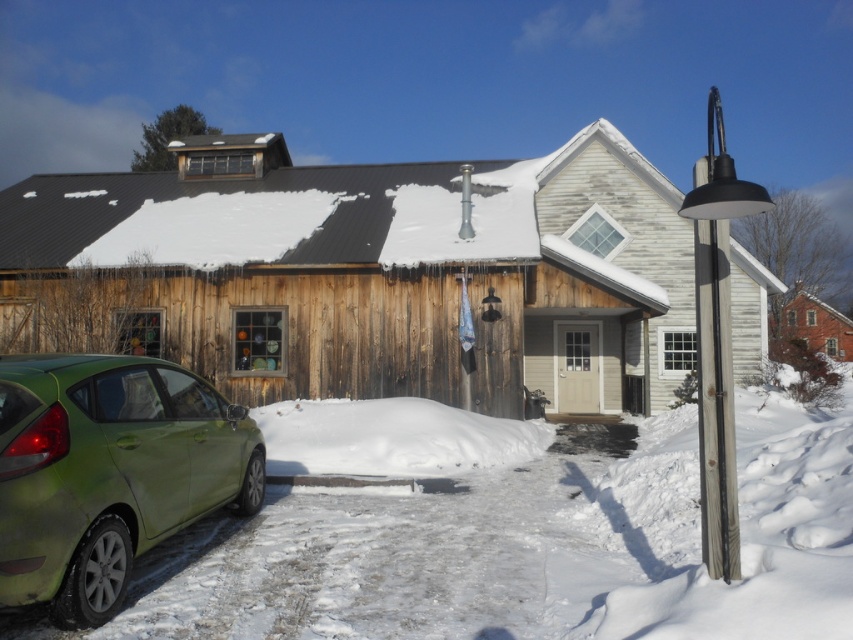
Based on the photo, you are standing in front of the house and want to place a new flower pot between the green matte car at lower left and the white fluffy snow at lower center. Is there enough space between them to place the flower pot?

The green matte car at lower left is positioned on the left side of white fluffy snow at lower center, so there is space between them to place the flower pot.

You are a delivery driver arriving at the house. You need to park your green matte car at lower left near the white fluffy snow at lower center. Is there enough vertical space between them for you to park without hitting the snow?

The green matte car at lower left is taller than the white fluffy snow at lower center, so there is sufficient vertical space to park without hitting the snow.

You are standing in front of the house and notice two points marked on the roof. The first point is at coordinate point (x=74, y=432) and the second is at point (x=439, y=458). Which point is closer to you?

Point (x=74, y=432) is closer to the camera than point (x=439, y=458).